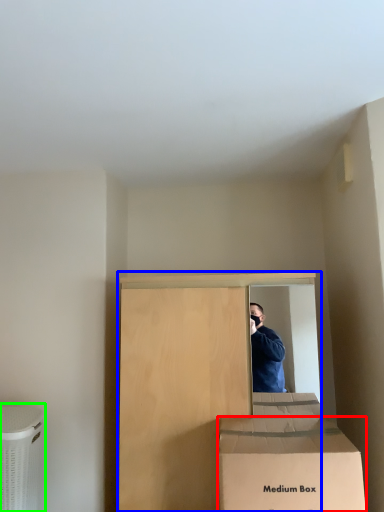
Question: Considering the real-world distances, which object is farthest from box (highlighted by a red box)? furniture (highlighted by a blue box) or cardboard box (highlighted by a green box)?

Choices:
 (A) furniture
 (B) cardboard box

Answer: (B)